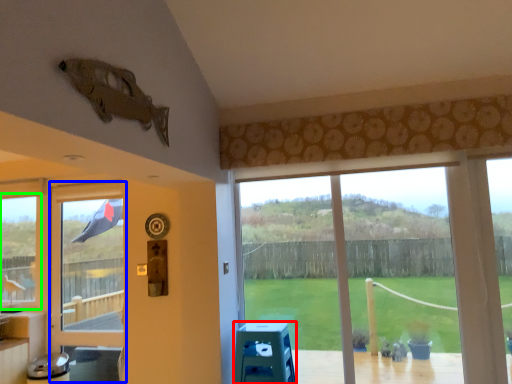
Question: Which object is the farthest from stool (highlighted by a red box)? Choose among these: screen door (highlighted by a blue box) or window (highlighted by a green box).

Choices:
 (A) screen door
 (B) window

Answer: (B)